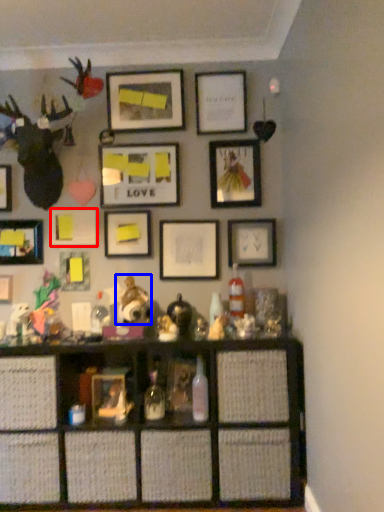
Question: Which object is closer to the camera taking this photo, picture frame (highlighted by a red box) or toy (highlighted by a blue box)?

Choices:
 (A) picture frame
 (B) toy

Answer: (B)